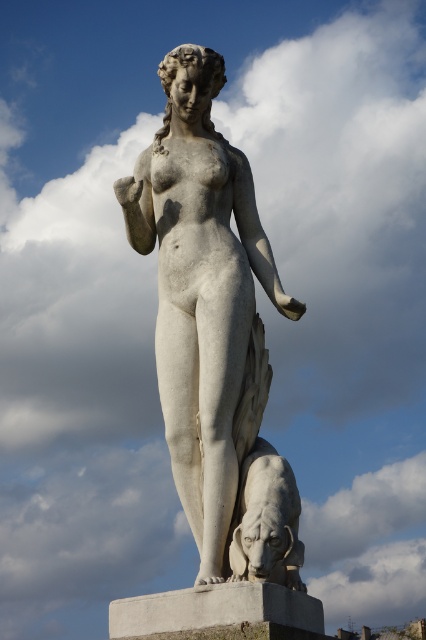
Looking at this image, who is more distant from viewer, (x=259, y=376) or (x=287, y=486)?

The point (x=259, y=376) is behind.

Who is lower down, white marble statue at center or white marble lion at lower center?

white marble lion at lower center is below.

Is point (178, 115) less distant than point (293, 584)?

That is False.

This screenshot has width=426, height=640. In order to click on white marble statue at center in this screenshot , I will do `click(213, 330)`.